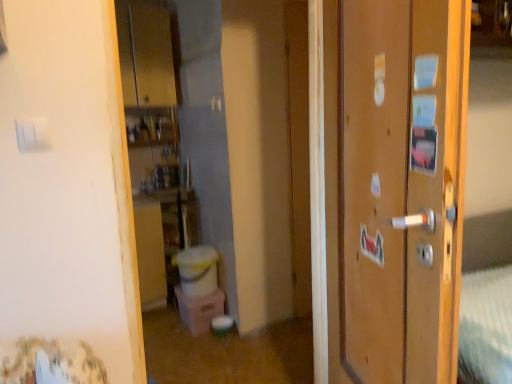
What is the approximate height of white plastic light switch at upper left?

3.74 inches.

The image size is (512, 384). I want to click on white plastic light switch at upper left, so click(x=33, y=134).

What do you see at coordinates (33, 134) in the screenshot? I see `white plastic light switch at upper left` at bounding box center [33, 134].

Measure the distance between point (413, 74) and camera.

Point (413, 74) and camera are 37.24 inches apart from each other.

Find the location of a particular element. The width and height of the screenshot is (512, 384). wooden door at right is located at coordinates (395, 187).

What do you see at coordinates (395, 187) in the screenshot? I see `wooden door at right` at bounding box center [395, 187].

Image resolution: width=512 pixels, height=384 pixels. I want to click on white plastic light switch at upper left, so click(33, 134).

Visually, is white plastic light switch at upper left positioned to the left or to the right of wooden door at right?

white plastic light switch at upper left is positioned on wooden door at right's left side.

Who is more distant, white plastic light switch at upper left or wooden door at right?

Positioned behind is white plastic light switch at upper left.

Considering the points (23, 129) and (434, 310), which point is in front, point (23, 129) or point (434, 310)?

The point (434, 310) is more forward.

From the image's perspective, which one is positioned lower, white plastic light switch at upper left or wooden door at right?

wooden door at right is shown below in the image.

From a real-world perspective, relative to wooden door at right, is white plastic light switch at upper left vertically above or below?

In terms of real-world spatial position, white plastic light switch at upper left is above wooden door at right.

Considering the sizes of objects white plastic light switch at upper left and wooden door at right in the image provided, who is thinner, white plastic light switch at upper left or wooden door at right?

Thinner between the two is white plastic light switch at upper left.

Does white plastic light switch at upper left have a lesser height compared to wooden door at right?

Correct, white plastic light switch at upper left is not as tall as wooden door at right.

In terms of size, does white plastic light switch at upper left appear bigger or smaller than wooden door at right?

Considering their sizes, white plastic light switch at upper left takes up less space than wooden door at right.

Is white plastic light switch at upper left completely or partially outside of wooden door at right?

Indeed, white plastic light switch at upper left is completely outside wooden door at right.

Is white plastic light switch at upper left not close to wooden door at right?

No, white plastic light switch at upper left is in close proximity to wooden door at right.

Could you tell me if white plastic light switch at upper left is facing wooden door at right?

No, white plastic light switch at upper left is not aimed at wooden door at right.

Consider the image. What's the angular difference between white plastic light switch at upper left and wooden door at right's facing directions?

The angular difference between white plastic light switch at upper left and wooden door at right is 110 degrees.

Find the location of a particular element. The image size is (512, 384). door below the white plastic light switch at upper left (from the image's perspective) is located at coordinates (395, 187).

Between wooden door at right and white plastic light switch at upper left, which one appears on the left side from the viewer's perspective?

→ Positioned to the left is white plastic light switch at upper left.

Is the position of wooden door at right less distant than that of white plastic light switch at upper left?

Yes, wooden door at right is in front of white plastic light switch at upper left.

Is point (336, 166) in front of point (42, 119)?

No, it is not.

From the image's perspective, relative to white plastic light switch at upper left, is wooden door at right above or below?

wooden door at right is situated lower than white plastic light switch at upper left in the image.

From a real-world perspective, is wooden door at right located beneath white plastic light switch at upper left?

Yes.

Considering the sizes of objects wooden door at right and white plastic light switch at upper left in the image provided, who is wider, wooden door at right or white plastic light switch at upper left?

wooden door at right is wider.

Which of these two, wooden door at right or white plastic light switch at upper left, stands shorter?

white plastic light switch at upper left is shorter.

Considering the relative sizes of wooden door at right and white plastic light switch at upper left in the image provided, is wooden door at right bigger than white plastic light switch at upper left?

Indeed, wooden door at right has a larger size compared to white plastic light switch at upper left.

Could white plastic light switch at upper left be considered to be inside wooden door at right?

No.

Are wooden door at right and white plastic light switch at upper left far apart?

They are positioned close to each other.

Is wooden door at right facing towards white plastic light switch at upper left?

Yes, wooden door at right is turned towards white plastic light switch at upper left.

What's the angular difference between wooden door at right and white plastic light switch at upper left's facing directions?

110 degrees.

Identify the location of door in front of the white plastic light switch at upper left. The image size is (512, 384). (395, 187).

This screenshot has width=512, height=384. I want to click on light switch behind the wooden door at right, so click(33, 134).

This screenshot has width=512, height=384. Find the location of `door below the white plastic light switch at upper left (from a real-world perspective)`. door below the white plastic light switch at upper left (from a real-world perspective) is located at coordinates (395, 187).